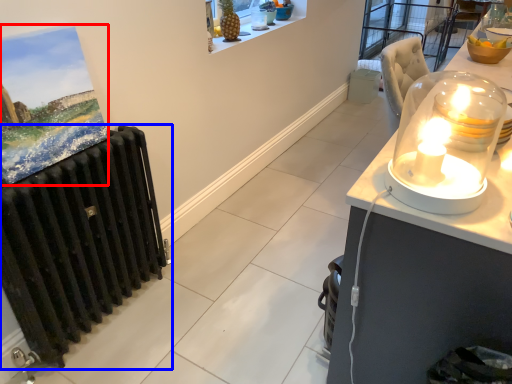
Question: Which object appears farthest to the camera in this image, picture frame (highlighted by a red box) or radiator (highlighted by a blue box)?

Choices:
 (A) picture frame
 (B) radiator

Answer: (B)